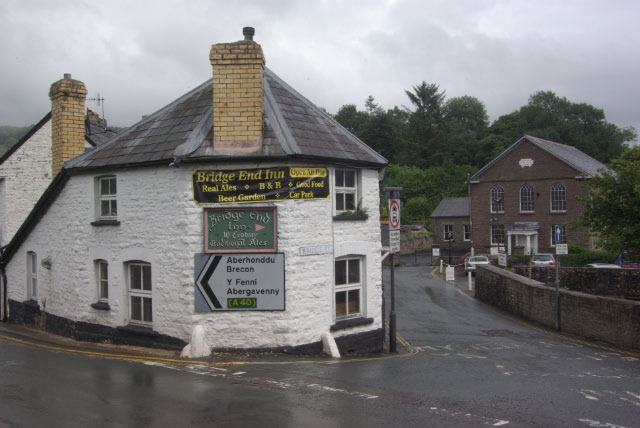
Locate an element on the screen. brick chimney is located at coordinates (61, 117), (244, 96).